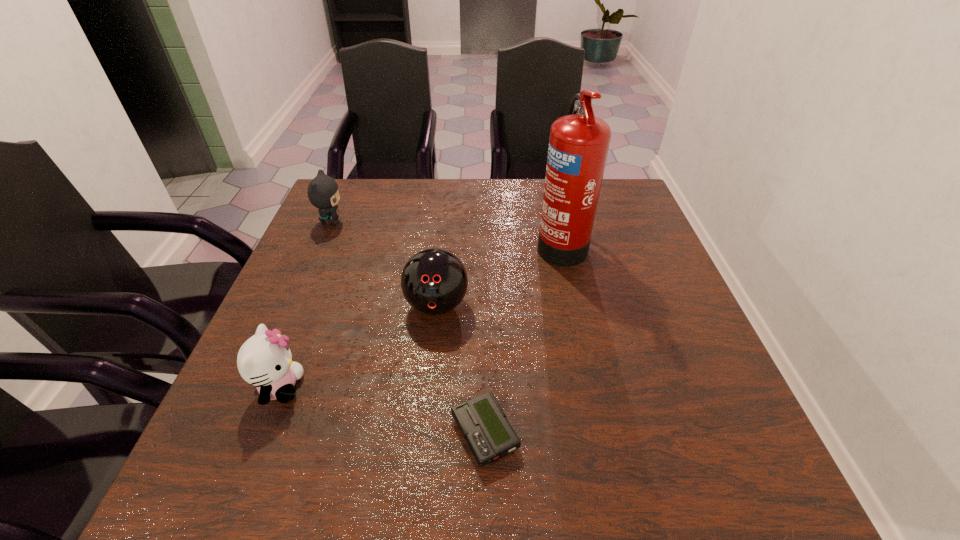
Where is `free space located on the front-facing side of the farther kitten`? free space located on the front-facing side of the farther kitten is located at coordinates (459, 221).

At what (x,y) coordinates should I click in order to perform the action: click on vacant space located 0.170m on the front-facing side of the nearer kitten. Please return your answer as a coordinate pair (x, y). Looking at the image, I should click on (392, 387).

The height and width of the screenshot is (540, 960). I want to click on vacant space located 0.330m on the back of the shortest object, so click(484, 281).

Where is `fire extinguisher that is at the far edge`? The height and width of the screenshot is (540, 960). fire extinguisher that is at the far edge is located at coordinates (578, 146).

Find the location of a particular element. This screenshot has width=960, height=540. kitten that is positioned at the far edge is located at coordinates (323, 192).

Identify the location of object that is at the near edge. (482, 422).

Image resolution: width=960 pixels, height=540 pixels. I want to click on object that is at the far left corner, so click(323, 192).

Locate an element on the screen. The height and width of the screenshot is (540, 960). free space at the far edge is located at coordinates (536, 178).

Identify the location of vacant space at the near edge. (505, 472).

This screenshot has height=540, width=960. In order to click on vacant space at the left edge in this screenshot , I will do (x=297, y=287).